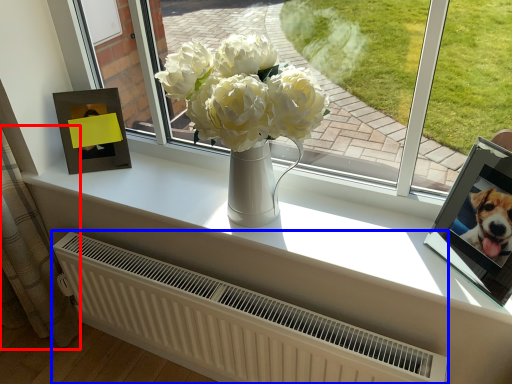
Question: Which object appears farthest to the camera in this image, curtain (highlighted by a red box) or radiator (highlighted by a blue box)?

Choices:
 (A) curtain
 (B) radiator

Answer: (A)